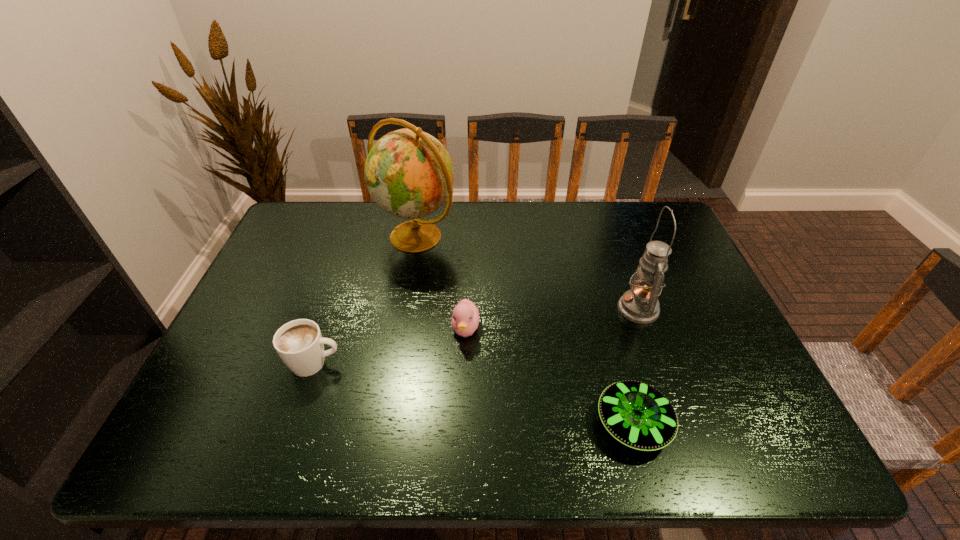
You are a GUI agent. You are given a task and a screenshot of the screen. Output one action in this format:
    pyautogui.click(x=<x>, y=<y>)
    Task: Click on the empty space that is in between the third object from left to right and the globe
    
    Given the screenshot: What is the action you would take?
    pyautogui.click(x=441, y=283)

Where is `vacant region between the fourth shortest object and the fourth farthest object`? Image resolution: width=960 pixels, height=540 pixels. vacant region between the fourth shortest object and the fourth farthest object is located at coordinates [x=476, y=336].

You are a GUI agent. You are given a task and a screenshot of the screen. Output one action in this format:
    pyautogui.click(x=<x>, y=<y>)
    Task: Click on the vacant space that is in between the fourth farthest object and the third object from right to left
    
    Given the screenshot: What is the action you would take?
    pyautogui.click(x=390, y=346)

Identify the location of vacant area that lies between the globe and the nearest object. The image size is (960, 540). (524, 330).

Locate an element on the screen. The image size is (960, 540). empty space between the third object from left to right and the fourth shortest object is located at coordinates (552, 319).

Identify the location of free space between the saucer and the oil lamp. This screenshot has width=960, height=540. (636, 366).

Where is `free point between the fourth farthest object and the tallest object`? free point between the fourth farthest object and the tallest object is located at coordinates (x=366, y=300).

Identify the location of vacant space in between the duckling and the saucer. The height and width of the screenshot is (540, 960). (549, 376).

Image resolution: width=960 pixels, height=540 pixels. In order to click on free spot between the oil lamp and the duckling in this screenshot , I will do `click(552, 319)`.

Identify which object is the third nearest to the second tallest object. Please provide its 2D coordinates. Your answer should be formatted as a tuple, i.e. [(x, y)], where the tuple contains the x and y coordinates of a point satisfying the conditions above.

[(409, 174)]